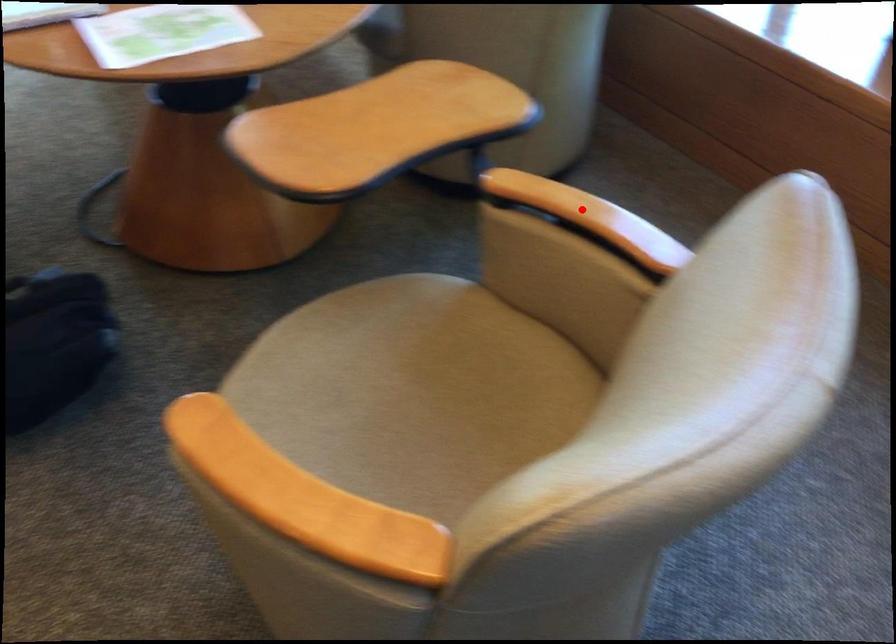
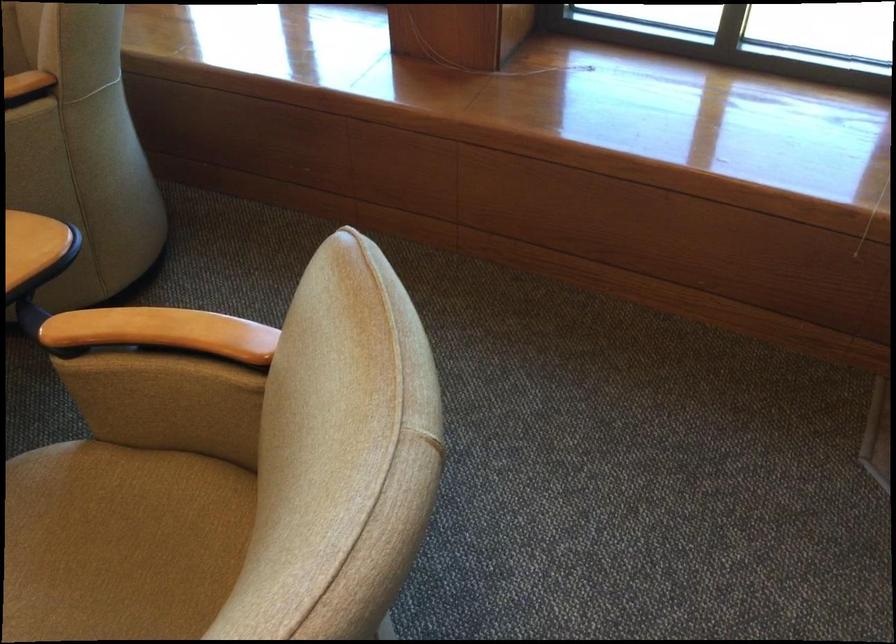
In the second image, find the point that corresponds to the highlighted location in the first image.

(161, 332)